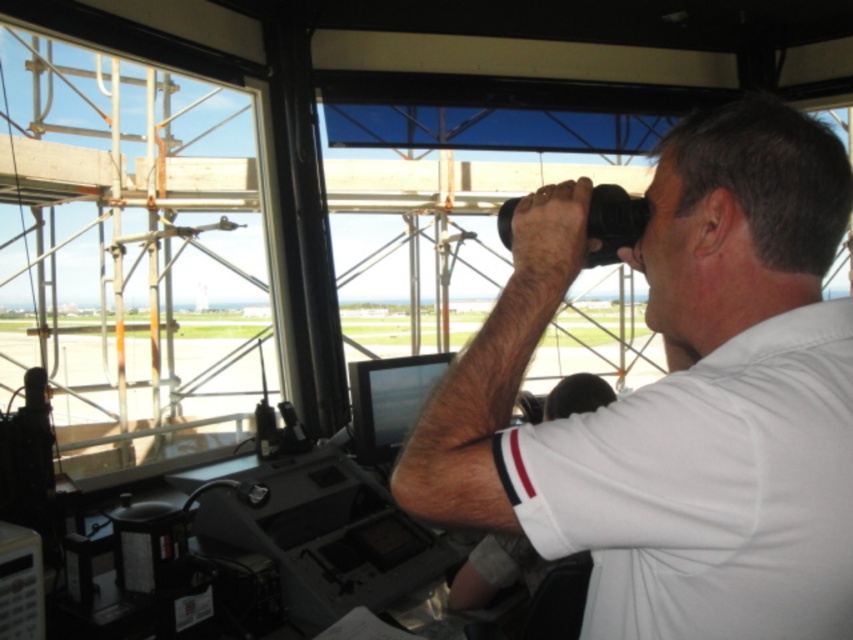
Question: Observing the image, what is the correct spatial positioning of white matte shirt at upper right in reference to clear glass window at upper left?

Choices:
 (A) right
 (B) left

Answer: (A)

Question: Is white matte shirt at upper right positioned in front of clear glass window at upper left?

Choices:
 (A) no
 (B) yes

Answer: (B)

Question: Which point is closer to the camera taking this photo?

Choices:
 (A) (734, 241)
 (B) (117, 172)

Answer: (A)

Question: Among these points, which one is farthest from the camera?

Choices:
 (A) coord(183,214)
 (B) coord(660,307)

Answer: (A)

Question: Is white matte shirt at upper right bigger than clear glass window at upper left?

Choices:
 (A) yes
 (B) no

Answer: (B)